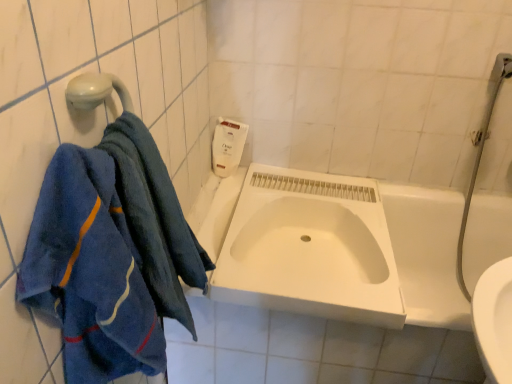
Consider the image. What is the approximate height of blue terry cloth towel at left, marked as the first towel in a front-to-back arrangement?

The height of blue terry cloth towel at left, marked as the first towel in a front-to-back arrangement, is 23.22 inches.

This screenshot has width=512, height=384. What are the coordinates of `blue terry cloth towel at left, positioned as the 1th towel in back-to-front order` in the screenshot? It's located at (155, 219).

This screenshot has height=384, width=512. Identify the location of white plastic soap dispenser at upper center. (228, 146).

Locate an element on the screen. blue terry cloth towel at left, positioned as the 2th towel in back-to-front order is located at coordinates (90, 272).

Is blue terry cloth towel at left, positioned as the 1th towel in back-to-front order, taller or shorter than white plastic soap dispenser at upper center?

blue terry cloth towel at left, positioned as the 1th towel in back-to-front order, is taller than white plastic soap dispenser at upper center.

From a real-world perspective, who is located higher, blue terry cloth towel at left, which is the second towel in front-to-back order, or white plastic soap dispenser at upper center?

From a 3D spatial view, blue terry cloth towel at left, which is the second towel in front-to-back order, is above.

Can you tell me how much blue terry cloth towel at left, positioned as the 1th towel in back-to-front order, and white plastic soap dispenser at upper center differ in facing direction?

blue terry cloth towel at left, positioned as the 1th towel in back-to-front order, and white plastic soap dispenser at upper center are facing 82.2 degrees away from each other.

From the image's perspective, relative to white matte sink at center, is white plastic soap dispenser at upper center above or below?

white plastic soap dispenser at upper center is above white matte sink at center.

Which object is further away from the camera, white plastic soap dispenser at upper center or white matte sink at center?

white plastic soap dispenser at upper center is behind.

Based on the photo, are white plastic soap dispenser at upper center and white matte sink at center making contact?

No, white plastic soap dispenser at upper center is not with white matte sink at center.

Which is more distant, (216,145) or (368,262)?

The point (216,145) is farther from the camera.

Would you consider blue terry cloth towel at left, positioned as the 2th towel in back-to-front order, to be distant from white plastic soap dispenser at upper center?

That's not correct — blue terry cloth towel at left, positioned as the 2th towel in back-to-front order, is a little close to white plastic soap dispenser at upper center.

Considering the relative sizes of blue terry cloth towel at left, marked as the first towel in a front-to-back arrangement, and white plastic soap dispenser at upper center in the image provided, is blue terry cloth towel at left, marked as the first towel in a front-to-back arrangement, smaller than white plastic soap dispenser at upper center?

No.

Is blue terry cloth towel at left, positioned as the 2th towel in back-to-front order, inside the boundaries of white plastic soap dispenser at upper center, or outside?

blue terry cloth towel at left, positioned as the 2th towel in back-to-front order, exists outside the volume of white plastic soap dispenser at upper center.

Considering the sizes of blue terry cloth towel at left, positioned as the 2th towel in back-to-front order, and white plastic soap dispenser at upper center in the image, is blue terry cloth towel at left, positioned as the 2th towel in back-to-front order, taller or shorter than white plastic soap dispenser at upper center?

Considering their sizes, blue terry cloth towel at left, positioned as the 2th towel in back-to-front order, has more height than white plastic soap dispenser at upper center.

Between blue terry cloth towel at left, positioned as the 2th towel in back-to-front order, and white matte sink at center, which one appears on the right side from the viewer's perspective?

Positioned to the right is white matte sink at center.

Based on their sizes in the image, would you say blue terry cloth towel at left, positioned as the 2th towel in back-to-front order, is bigger or smaller than white matte sink at center?

blue terry cloth towel at left, positioned as the 2th towel in back-to-front order, is smaller than white matte sink at center.

Is blue terry cloth towel at left, marked as the first towel in a front-to-back arrangement, looking in the opposite direction of white matte sink at center?

No.

How far apart are blue terry cloth towel at left, positioned as the 2th towel in back-to-front order, and white matte sink at center?

blue terry cloth towel at left, positioned as the 2th towel in back-to-front order, is 23.21 inches from white matte sink at center.

Is blue terry cloth towel at left, which is the second towel in front-to-back order, further to camera compared to blue terry cloth towel at left, positioned as the 2th towel in back-to-front order?

Yes, the depth of blue terry cloth towel at left, which is the second towel in front-to-back order, is greater than that of blue terry cloth towel at left, positioned as the 2th towel in back-to-front order.

From a real-world perspective, who is located lower, blue terry cloth towel at left, which is the second towel in front-to-back order, or blue terry cloth towel at left, positioned as the 2th towel in back-to-front order?

From a 3D spatial view, blue terry cloth towel at left, which is the second towel in front-to-back order, is below.

In the scene shown: Can you confirm if blue terry cloth towel at left, which is the second towel in front-to-back order, is positioned to the right of blue terry cloth towel at left, marked as the first towel in a front-to-back arrangement?

Correct, you'll find blue terry cloth towel at left, which is the second towel in front-to-back order, to the right of blue terry cloth towel at left, marked as the first towel in a front-to-back arrangement.

Is blue terry cloth towel at left, which is the second towel in front-to-back order, wider than blue terry cloth towel at left, positioned as the 2th towel in back-to-front order?

Correct, the width of blue terry cloth towel at left, which is the second towel in front-to-back order, exceeds that of blue terry cloth towel at left, positioned as the 2th towel in back-to-front order.

Is white matte sink at center directly adjacent to white plastic soap dispenser at upper center?

No, white matte sink at center is not making contact with white plastic soap dispenser at upper center.

From the image's perspective, is white matte sink at center located beneath white plastic soap dispenser at upper center?

Indeed, from the image's perspective, white matte sink at center is shown beneath white plastic soap dispenser at upper center.

Consider the image. Can you confirm if white matte sink at center is bigger than white plastic soap dispenser at upper center?

Indeed, white matte sink at center has a larger size compared to white plastic soap dispenser at upper center.

What's the angular difference between white matte sink at center and white plastic soap dispenser at upper center's facing directions?

white matte sink at center and white plastic soap dispenser at upper center are facing 2.06 degrees away from each other.

In terms of width, does blue terry cloth towel at left, marked as the first towel in a front-to-back arrangement, look wider or thinner when compared to blue terry cloth towel at left, which is the second towel in front-to-back order?

blue terry cloth towel at left, marked as the first towel in a front-to-back arrangement, is thinner than blue terry cloth towel at left, which is the second towel in front-to-back order.

From the picture: Is blue terry cloth towel at left, positioned as the 2th towel in back-to-front order, positioned in front of blue terry cloth towel at left, which is the second towel in front-to-back order?

Yes, blue terry cloth towel at left, positioned as the 2th towel in back-to-front order, is closer to the camera.

Considering the relative sizes of blue terry cloth towel at left, positioned as the 2th towel in back-to-front order, and blue terry cloth towel at left, positioned as the 1th towel in back-to-front order, in the image provided, is blue terry cloth towel at left, positioned as the 2th towel in back-to-front order, smaller than blue terry cloth towel at left, positioned as the 1th towel in back-to-front order,?

No.

Is blue terry cloth towel at left, positioned as the 2th towel in back-to-front order, in contact with blue terry cloth towel at left, positioned as the 1th towel in back-to-front order?

They are not placed beside each other.

The image size is (512, 384). I want to click on soap dispenser on the right of blue terry cloth towel at left, positioned as the 1th towel in back-to-front order, so click(x=228, y=146).

The height and width of the screenshot is (384, 512). What are the coordinates of `soap dispenser above the white matte sink at center (from the image's perspective)` in the screenshot? It's located at (228, 146).

Based on their spatial positions, is white plastic soap dispenser at upper center or blue terry cloth towel at left, positioned as the 2th towel in back-to-front order, further from white matte sink at center?

blue terry cloth towel at left, positioned as the 2th towel in back-to-front order, is further to white matte sink at center.

Looking at the image, which one is located further to white plastic soap dispenser at upper center, blue terry cloth towel at left, which is the second towel in front-to-back order, or white matte sink at center?

Based on the image, blue terry cloth towel at left, which is the second towel in front-to-back order, appears to be further to white plastic soap dispenser at upper center.

From the image, which object appears to be nearer to blue terry cloth towel at left, positioned as the 2th towel in back-to-front order, white plastic soap dispenser at upper center or white matte sink at center?

The object closer to blue terry cloth towel at left, positioned as the 2th towel in back-to-front order, is white matte sink at center.

From the image, which object appears to be farther from blue terry cloth towel at left, positioned as the 1th towel in back-to-front order, white plastic soap dispenser at upper center or blue terry cloth towel at left, positioned as the 2th towel in back-to-front order?

white plastic soap dispenser at upper center is further to blue terry cloth towel at left, positioned as the 1th towel in back-to-front order.

Which object lies nearer to the anchor point white matte sink at center, blue terry cloth towel at left, marked as the first towel in a front-to-back arrangement, or white plastic soap dispenser at upper center?

Among the two, white plastic soap dispenser at upper center is located nearer to white matte sink at center.

Based on the photo, based on their spatial positions, is white plastic soap dispenser at upper center or white matte sink at center further from blue terry cloth towel at left, which is the second towel in front-to-back order?

Based on the image, white plastic soap dispenser at upper center appears to be further to blue terry cloth towel at left, which is the second towel in front-to-back order.

In the scene shown: Estimate the real-world distances between objects in this image. Which object is closer to white matte sink at center, blue terry cloth towel at left, positioned as the 1th towel in back-to-front order, or white plastic soap dispenser at upper center?

blue terry cloth towel at left, positioned as the 1th towel in back-to-front order, is positioned closer to the anchor white matte sink at center.

Estimate the real-world distances between objects in this image. Which object is further from white plastic soap dispenser at upper center, blue terry cloth towel at left, marked as the first towel in a front-to-back arrangement, or blue terry cloth towel at left, which is the second towel in front-to-back order?

The object further to white plastic soap dispenser at upper center is blue terry cloth towel at left, marked as the first towel in a front-to-back arrangement.

Locate an element on the screen. Image resolution: width=512 pixels, height=384 pixels. towel between blue terry cloth towel at left, positioned as the 2th towel in back-to-front order, and white plastic soap dispenser at upper center, along the z-axis is located at coordinates (155, 219).

What are the coordinates of `towel between blue terry cloth towel at left, positioned as the 2th towel in back-to-front order, and white matte sink at center from front to back` in the screenshot? It's located at (155, 219).

At what (x,y) coordinates should I click in order to perform the action: click on sink between blue terry cloth towel at left, marked as the first towel in a front-to-back arrangement, and white plastic soap dispenser at upper center, along the z-axis. Please return your answer as a coordinate pair (x, y). The width and height of the screenshot is (512, 384). Looking at the image, I should click on (310, 248).

Identify the location of sink located between blue terry cloth towel at left, which is the second towel in front-to-back order, and white plastic soap dispenser at upper center in the depth direction. The height and width of the screenshot is (384, 512). (310, 248).